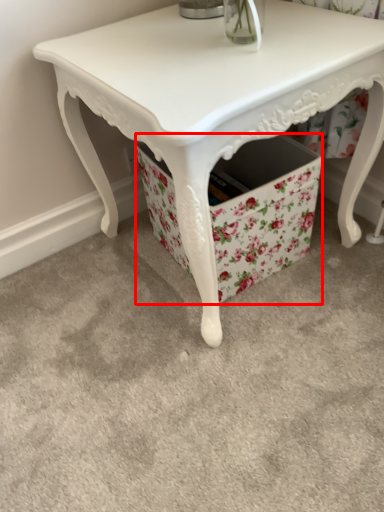
Question: From the image, what is the correct spatial relationship of storage box (annotated by the red box) in relation to table?

Choices:
 (A) right
 (B) left

Answer: (A)